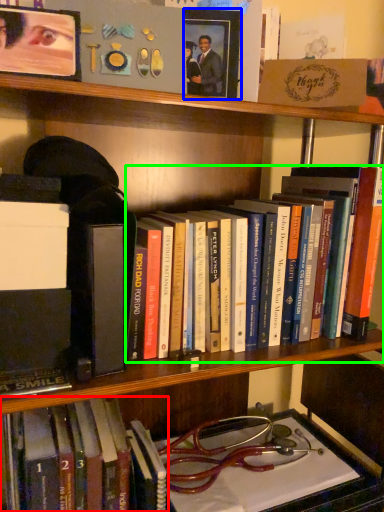
Question: Which is farther away from book (highlighted by a red box)? picture frame (highlighted by a blue box) or book (highlighted by a green box)?

Choices:
 (A) picture frame
 (B) book

Answer: (A)